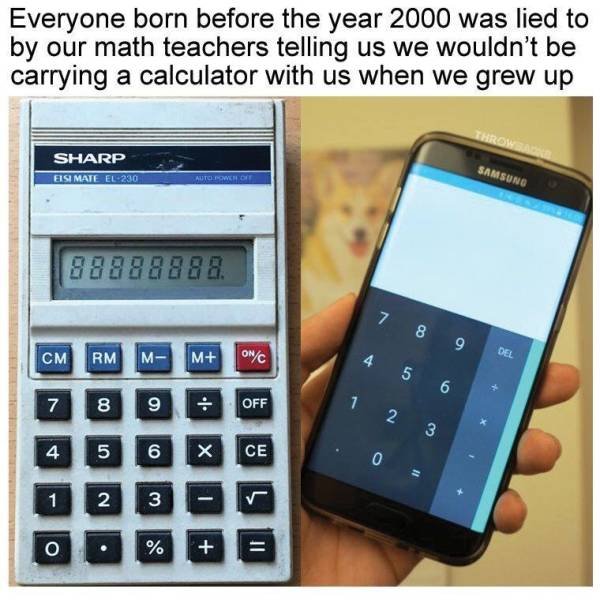
Identify the location of dog poster. (350, 219).